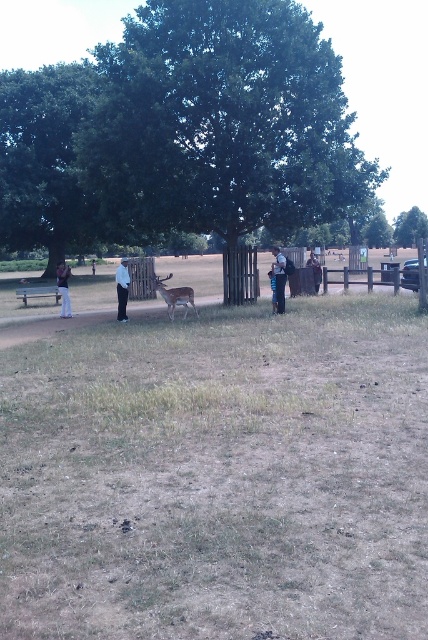
Between green leafy tree at upper center and brown velvet deer at center, which one appears on the left side from the viewer's perspective?

Positioned to the left is brown velvet deer at center.

Who is more forward, (403, 225) or (184, 291)?

Point (184, 291) is more forward.

Locate an element on the screen. Image resolution: width=428 pixels, height=640 pixels. green leafy tree at upper center is located at coordinates (410, 227).

Is point (276, 246) positioned in front of point (70, 272)?

No, it is behind (70, 272).

Which is behind, point (278, 308) or point (68, 310)?

The point (68, 310) is behind.

Is point (284, 282) farther from camera compared to point (65, 307)?

That is False.

The height and width of the screenshot is (640, 428). In order to click on light blue jeans at center in this screenshot , I will do `click(279, 276)`.

Based on the photo, does brown wooden fence at center have a larger size compared to light blue jeans at center?

Yes.

Does brown wooden fence at center appear on the right side of light blue jeans at center?

In fact, brown wooden fence at center is to the left of light blue jeans at center.

Is point (229, 568) behind point (279, 285)?

No.

Locate an element on the screen. This screenshot has width=428, height=640. brown wooden fence at center is located at coordinates (214, 467).